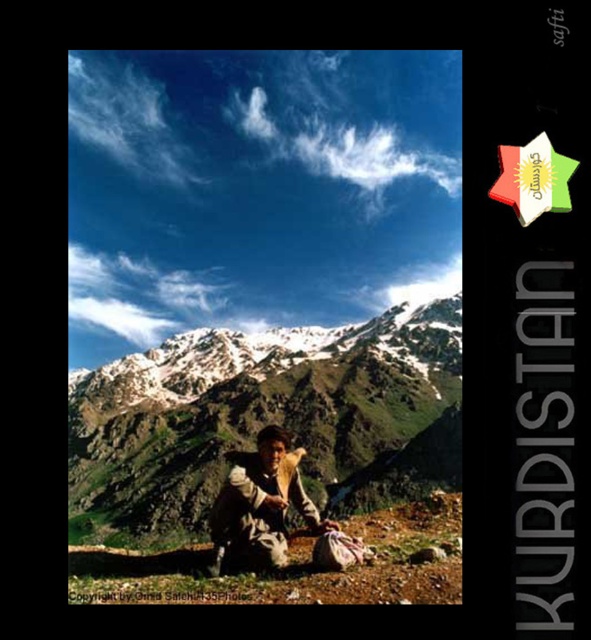
Question: Which object appears closest to the camera in this image?

Choices:
 (A) snowy rock mountain at center
 (B) brown woolen jacket at center

Answer: (B)

Question: Which object appears farthest from the camera in this image?

Choices:
 (A) snowy rock mountain at center
 (B) brown woolen jacket at center

Answer: (A)

Question: Is snowy rock mountain at center bigger than brown woolen jacket at center?

Choices:
 (A) no
 (B) yes

Answer: (B)

Question: Considering the relative positions of snowy rock mountain at center and brown woolen jacket at center in the image provided, where is snowy rock mountain at center located with respect to brown woolen jacket at center?

Choices:
 (A) below
 (B) above

Answer: (B)

Question: Which of the following is the closest to the observer?

Choices:
 (A) brown woolen jacket at center
 (B) snowy rock mountain at center

Answer: (A)

Question: Can you confirm if snowy rock mountain at center is positioned to the left of brown woolen jacket at center?

Choices:
 (A) yes
 (B) no

Answer: (A)